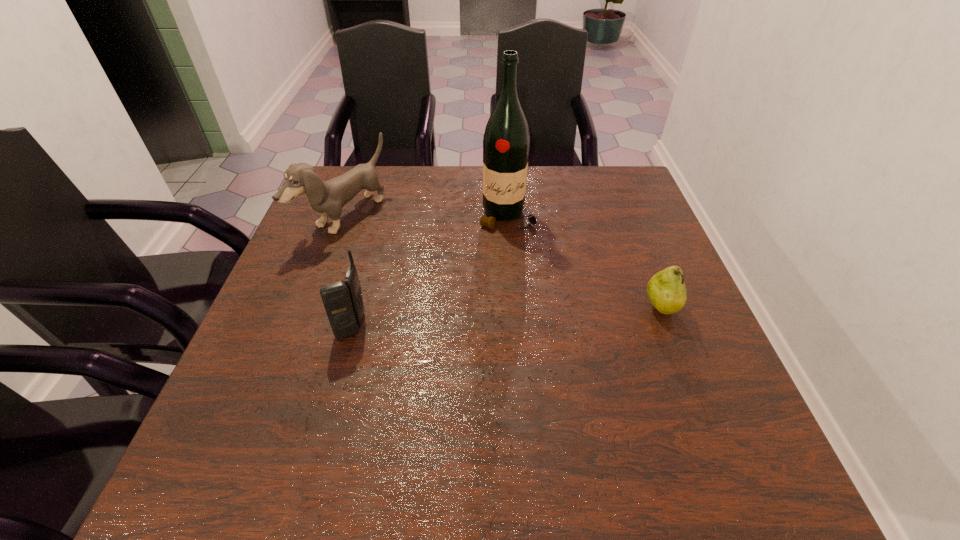
At what (x,y) coordinates should I click in order to perform the action: click on vacant area between the rightmost object and the cellular telephone. Please return your answer as a coordinate pair (x, y). Looking at the image, I should click on (506, 318).

Where is `unoccupied position between the wine bottle and the puppy`? The image size is (960, 540). unoccupied position between the wine bottle and the puppy is located at coordinates (426, 217).

Locate an element on the screen. Image resolution: width=960 pixels, height=540 pixels. unoccupied area between the cellular telephone and the rightmost object is located at coordinates (506, 318).

The height and width of the screenshot is (540, 960). Identify the location of blank region between the cellular telephone and the tallest object. (429, 271).

I want to click on free spot between the wine bottle and the shortest object, so click(584, 262).

Identify the location of object identified as the second closest to the cellular telephone. The width and height of the screenshot is (960, 540). (506, 141).

Select which object is the second closest to the pear. Please provide its 2D coordinates. Your answer should be formatted as a tuple, i.e. [(x, y)], where the tuple contains the x and y coordinates of a point satisfying the conditions above.

[(343, 302)]